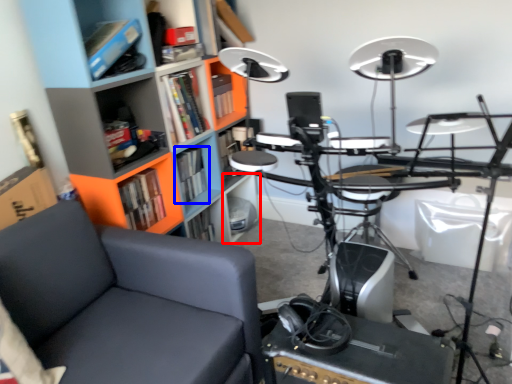
Question: Among these objects, which one is farthest to the camera, shelf (highlighted by a red box) or book (highlighted by a blue box)?

Choices:
 (A) shelf
 (B) book

Answer: (A)